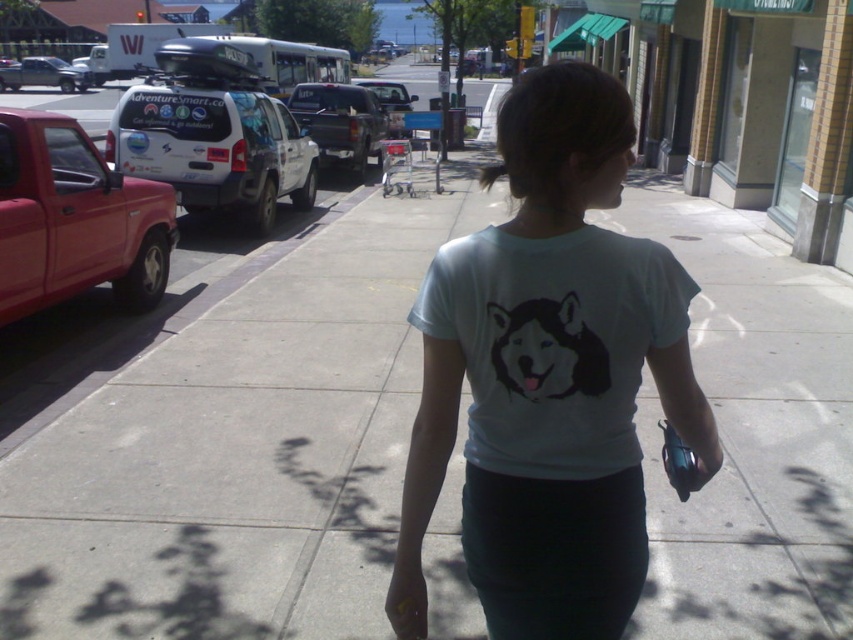
Does point (473, 419) come in front of point (91, 147)?

Yes, point (473, 419) is in front of point (91, 147).

Is white matte t-shirt at center closer to camera compared to matte red truck at left?

Yes, white matte t-shirt at center is closer to the viewer.

Does point (548, 184) come in front of point (47, 289)?

Yes, point (548, 184) is closer to viewer.

Image resolution: width=853 pixels, height=640 pixels. In order to click on white matte t-shirt at center in this screenshot , I will do `click(549, 378)`.

Is matte red truck at left to the right of matte black truck at left from the viewer's perspective?

Correct, you'll find matte red truck at left to the right of matte black truck at left.

Who is positioned more to the right, matte red truck at left or matte black truck at left?

From the viewer's perspective, matte red truck at left appears more on the right side.

Measure the distance between point (4, 109) and camera.

5.70 meters

The height and width of the screenshot is (640, 853). What are the coordinates of `matte red truck at left` in the screenshot? It's located at (74, 220).

Which is more to the left, light blue cotton t-shirt at center or matte black truck at center?

From the viewer's perspective, matte black truck at center appears more on the left side.

Identify the location of light blue cotton t-shirt at center. The image size is (853, 640). (553, 342).

Is point (627, 246) behind point (320, 100)?

No, (627, 246) is closer to viewer.

Find the location of a particular element. light blue cotton t-shirt at center is located at coordinates (553, 342).